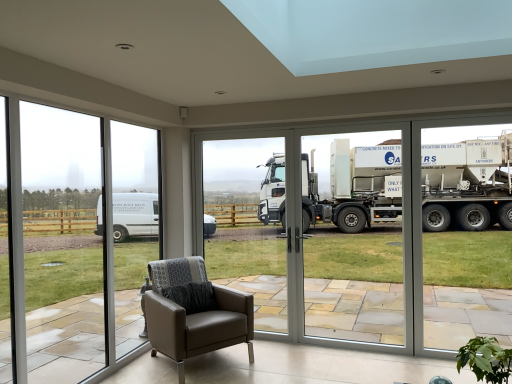
Image resolution: width=512 pixels, height=384 pixels. I want to click on transparent glass window at left, so click(x=62, y=244).

This screenshot has height=384, width=512. Find the location of `white glossy truck at center`. white glossy truck at center is located at coordinates pyautogui.click(x=360, y=242).

This screenshot has width=512, height=384. What are the coordinates of `green leafy plant at lower right` in the screenshot? It's located at (486, 359).

Describe the element at coordinates (194, 312) in the screenshot. The height and width of the screenshot is (384, 512). I see `brown leather armchair at lower center` at that location.

The height and width of the screenshot is (384, 512). I want to click on transparent glass window at left, so click(62, 244).

Considering the sizes of objects transparent glass door at center and brown leather armchair at lower center in the image provided, who is smaller, transparent glass door at center or brown leather armchair at lower center?

transparent glass door at center is smaller.

Could you tell me if transparent glass door at center is facing brown leather armchair at lower center?

Yes, transparent glass door at center faces towards brown leather armchair at lower center.

Which of these two, transparent glass door at center or brown leather armchair at lower center, is thinner?

transparent glass door at center.

Looking at this image, which object is positioned more to the left, transparent glass door at center or brown leather armchair at lower center?

brown leather armchair at lower center is more to the left.

Considering the relative sizes of brown leather armchair at lower center and green leafy plant at lower right in the image provided, is brown leather armchair at lower center thinner than green leafy plant at lower right?

No, brown leather armchair at lower center is not thinner than green leafy plant at lower right.

From a real-world perspective, between brown leather armchair at lower center and green leafy plant at lower right, who is vertically lower?

From a 3D spatial view, brown leather armchair at lower center is below.

Image resolution: width=512 pixels, height=384 pixels. Identify the location of chair below the green leafy plant at lower right (from a real-world perspective). coord(194,312).

Considering the positions of objects brown leather armchair at lower center and green leafy plant at lower right in the image provided, who is more to the right, brown leather armchair at lower center or green leafy plant at lower right?

green leafy plant at lower right.

Could you tell me if green leafy plant at lower right is turned towards transparent glass door at center?

No, green leafy plant at lower right is not oriented towards transparent glass door at center.

Looking at their sizes, would you say green leafy plant at lower right is wider or thinner than transparent glass door at center?

Considering their sizes, green leafy plant at lower right looks broader than transparent glass door at center.

From the image's perspective, is green leafy plant at lower right above transparent glass door at center?

No, from the image's perspective, green leafy plant at lower right is not over transparent glass door at center.

From a real-world perspective, which is physically below, green leafy plant at lower right or transparent glass door at center?

In real-world perspective, green leafy plant at lower right is lower.

Is brown leather armchair at lower center far away from transparent glass window at left?

brown leather armchair at lower center is actually quite close to transparent glass window at left.

From the image's perspective, is brown leather armchair at lower center above transparent glass window at left?

No, from the image's perspective, brown leather armchair at lower center is not above transparent glass window at left.

From a real-world perspective, is brown leather armchair at lower center located higher than transparent glass window at left?

Actually, brown leather armchair at lower center is physically below transparent glass window at left in the real world.

Is brown leather armchair at lower center turned away from white glossy truck at center?

No, brown leather armchair at lower center is not facing away from white glossy truck at center.

Identify the location of screen door above the brown leather armchair at lower center (from a real-world perspective). The width and height of the screenshot is (512, 384). (x=360, y=242).

Between brown leather armchair at lower center and white glossy truck at center, which one has larger size?

With larger size is brown leather armchair at lower center.

In terms of height, does brown leather armchair at lower center look taller or shorter compared to white glossy truck at center?

brown leather armchair at lower center is shorter than white glossy truck at center.

From the image's perspective, which one is positioned higher, white glossy truck at center or brown leather armchair at lower center?

From the image's view, white glossy truck at center is above.

Consider the image. Which is behind, white glossy truck at center or brown leather armchair at lower center?

white glossy truck at center is more distant.

Which of these two, white glossy truck at center or brown leather armchair at lower center, stands shorter?

brown leather armchair at lower center is shorter.

In the scene shown: Is white glossy truck at center further to the viewer compared to transparent glass window at left?

Yes, the depth of white glossy truck at center is greater than that of transparent glass window at left.

Is white glossy truck at center oriented towards transparent glass window at left?

No, white glossy truck at center does not turn towards transparent glass window at left.

From a real-world perspective, which object rests below the other?

From a 3D spatial view, white glossy truck at center is below.

This screenshot has width=512, height=384. I want to click on chair in front of the transparent glass door at center, so [194, 312].

Identify the location of plant that appears on the right of brown leather armchair at lower center. (486, 359).

From the image, which object appears to be nearer to transparent glass door at center, transparent glass window at left or green leafy plant at lower right?

Based on the image, transparent glass window at left appears to be nearer to transparent glass door at center.

Looking at the image, which one is located further to transparent glass window at left, brown leather armchair at lower center or transparent glass door at center?

transparent glass door at center is positioned further to the anchor transparent glass window at left.

From the image, which object appears to be farther from transparent glass door at center, white glossy truck at center or green leafy plant at lower right?

The object further to transparent glass door at center is green leafy plant at lower right.

From the image, which object appears to be nearer to green leafy plant at lower right, brown leather armchair at lower center or transparent glass window at left?

brown leather armchair at lower center.

Which object lies further to the anchor point white glossy truck at center, transparent glass window at left or green leafy plant at lower right?

green leafy plant at lower right lies further to white glossy truck at center than the other object.

When comparing their distances from transparent glass door at center, does transparent glass window at left or brown leather armchair at lower center seem closer?

The object closer to transparent glass door at center is transparent glass window at left.

Estimate the real-world distances between objects in this image. Which object is further from green leafy plant at lower right, transparent glass window at left or white glossy truck at center?

white glossy truck at center.

Estimate the real-world distances between objects in this image. Which object is closer to brown leather armchair at lower center, white glossy truck at center or transparent glass window at left?

Among the two, transparent glass window at left is located nearer to brown leather armchair at lower center.

Locate an element on the screen. This screenshot has height=384, width=512. chair between transparent glass window at left and white glossy truck at center in the horizontal direction is located at coordinates (194, 312).

What are the coordinates of `window screen between transparent glass window at left and green leafy plant at lower right in the horizontal direction` in the screenshot? It's located at (239, 209).

Find the location of a particular element. The height and width of the screenshot is (384, 512). screen door between green leafy plant at lower right and transparent glass door at center from front to back is located at coordinates (360, 242).

Where is `window screen between brown leather armchair at lower center and white glossy truck at center`? The width and height of the screenshot is (512, 384). window screen between brown leather armchair at lower center and white glossy truck at center is located at coordinates click(x=239, y=209).